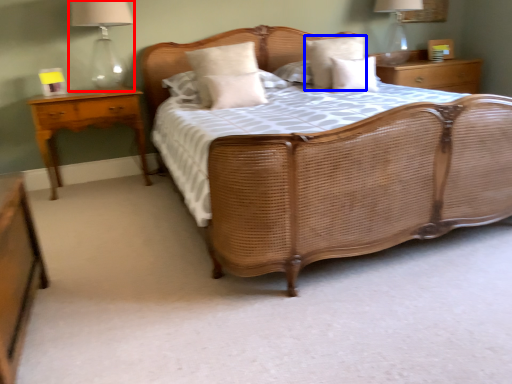
Question: Which object is further to the camera taking this photo, bedside lamp (highlighted by a red box) or pillow (highlighted by a blue box)?

Choices:
 (A) bedside lamp
 (B) pillow

Answer: (B)